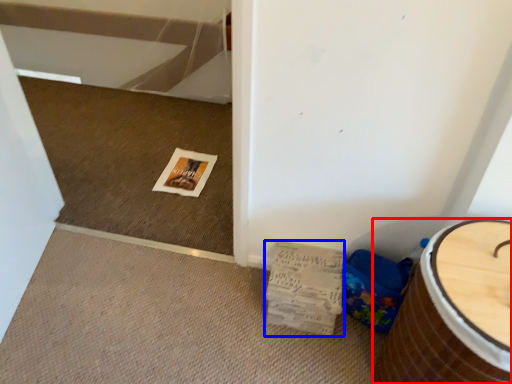
Question: Which object is further to the camera taking this photo, furniture (highlighted by a red box) or magazine (highlighted by a blue box)?

Choices:
 (A) furniture
 (B) magazine

Answer: (B)